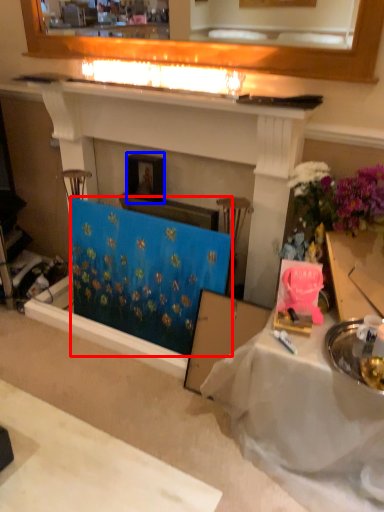
Question: Among these objects, which one is farthest to the camera, curtain (highlighted by a red box) or picture frame (highlighted by a blue box)?

Choices:
 (A) curtain
 (B) picture frame

Answer: (B)